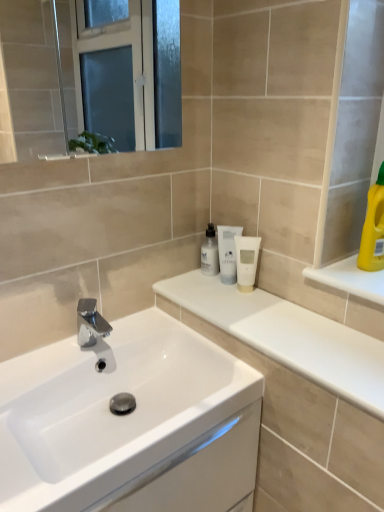
This screenshot has width=384, height=512. I want to click on free location above white glossy counter at center (from a real-world perspective), so click(x=274, y=318).